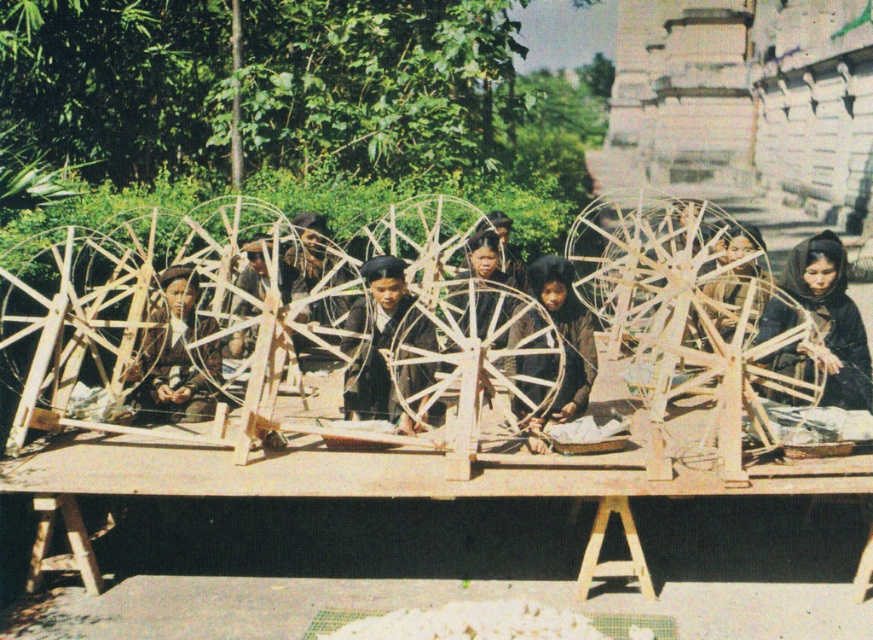
Question: Which object is closer to the camera taking this photo?

Choices:
 (A) brown fabric at center
 (B) dark brown wooden spinning wheel at center

Answer: (A)

Question: Does dark brown wooden spinning wheel at center appear over brown fabric at center?

Choices:
 (A) yes
 (B) no

Answer: (A)

Question: Is dark brown fabric at center below dark brown wooden spinning wheel at center?

Choices:
 (A) yes
 (B) no

Answer: (B)

Question: Which is nearer to the brown fabric at center?

Choices:
 (A) brown wooden spinning wheel at center
 (B) dark brown wooden spinning wheel at center

Answer: (B)

Question: Is dark brown fabric at center positioned behind brown wooden spinning wheel at center?

Choices:
 (A) no
 (B) yes

Answer: (A)

Question: Which object is closer to the camera taking this photo?

Choices:
 (A) dark brown wooden spinning wheel at center
 (B) brown fabric at center
 (C) dark brown fabric at center

Answer: (C)